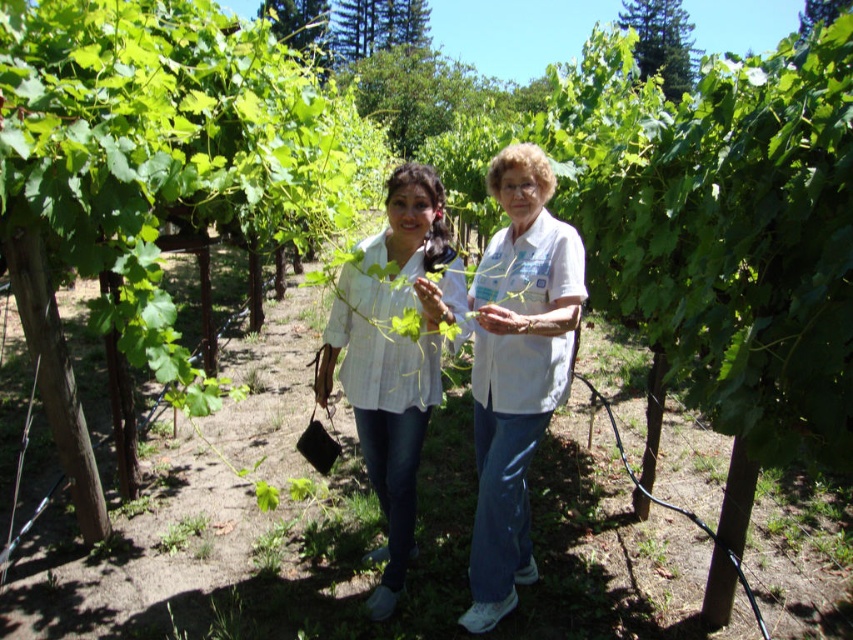
Question: Where is white cotton shirt at center located in relation to white matte shirt at center in the image?

Choices:
 (A) left
 (B) right

Answer: (B)

Question: Can you confirm if white cotton shirt at center is positioned to the right of white matte shirt at center?

Choices:
 (A) yes
 (B) no

Answer: (A)

Question: Can you confirm if white cotton shirt at center is bigger than white matte shirt at center?

Choices:
 (A) no
 (B) yes

Answer: (A)

Question: Which point appears farthest from the camera in this image?

Choices:
 (A) (519, 477)
 (B) (422, 168)

Answer: (B)

Question: Which point is closer to the camera?

Choices:
 (A) (572, 355)
 (B) (427, 243)

Answer: (B)